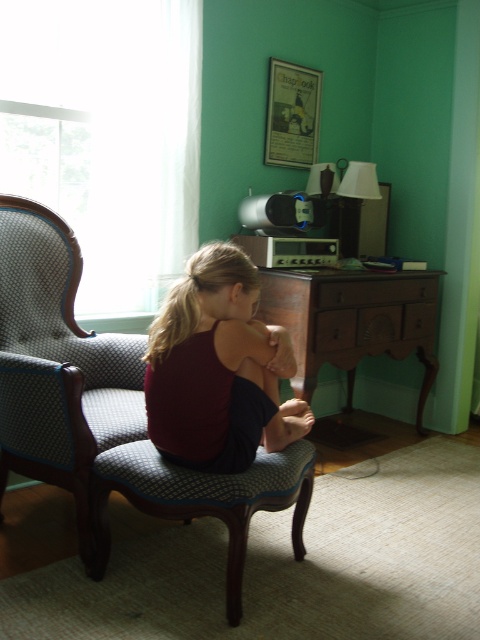
You are standing in the room and want to place a small potted plant on the object that is lower between the brown wood dresser at center and the patterned fabric stool at center. Which object should you choose?

The patterned fabric stool at center is lower than the brown wood dresser at center, so you should place the small potted plant on the patterned fabric stool at center.

You are organizing a small party in the room and need to place a decorative pillow that is 18 inches wide. You have two options for placement on the matte red tank top at center and brown wood dresser at center. Which object can accommodate the pillow without it hanging off the edges?

The brown wood dresser at center has a larger size than the matte red tank top at center, so the pillow can fit on the brown wood dresser at center.